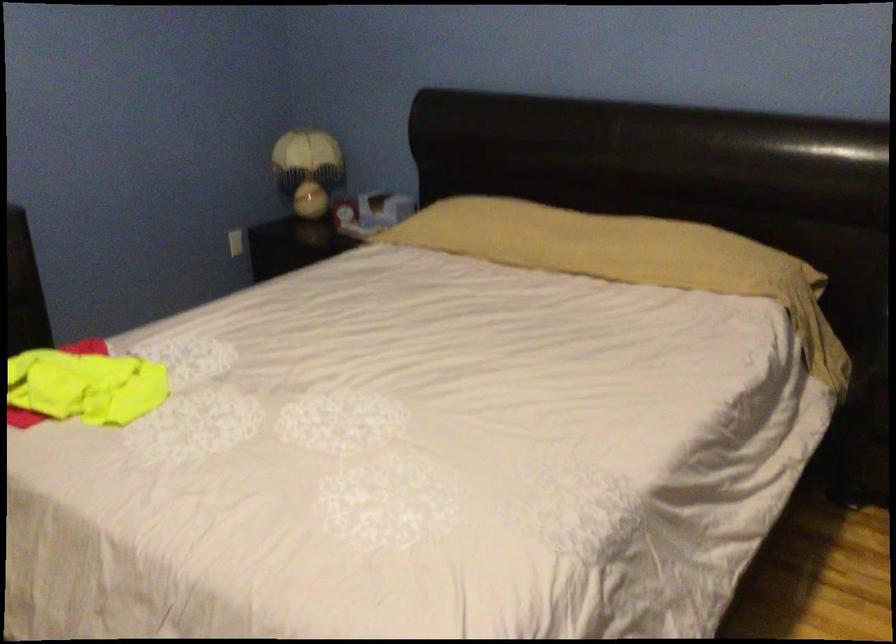
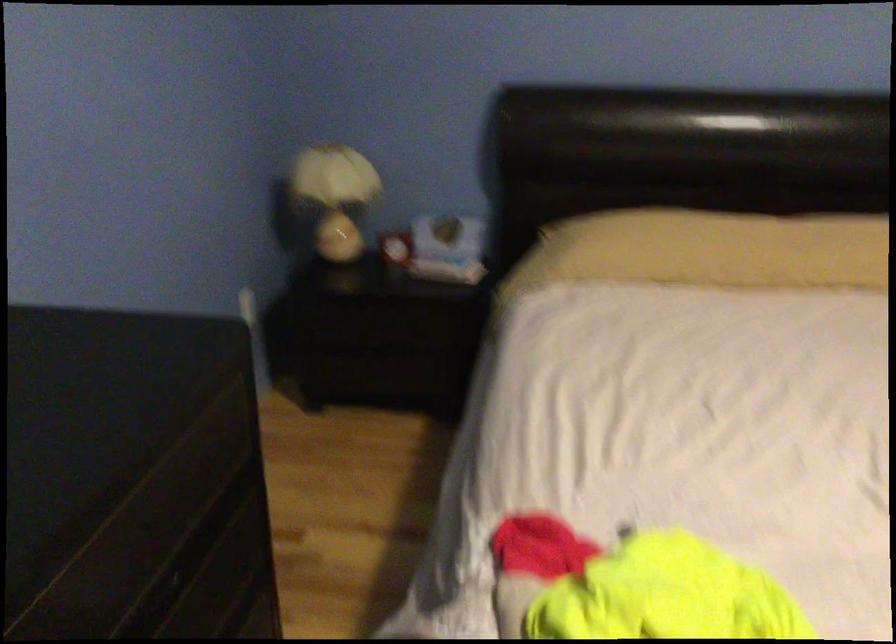
In the second image, find the point that corresponds to pixel 290 167 in the first image.

(332, 196)